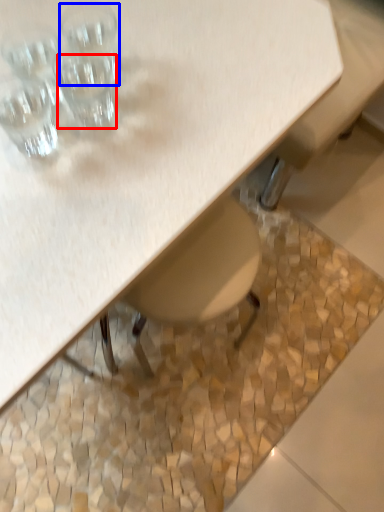
Question: Which of the following is the farthest to the observer, shot glass (highlighted by a red box) or shot glass (highlighted by a blue box)?

Choices:
 (A) shot glass
 (B) shot glass

Answer: (B)